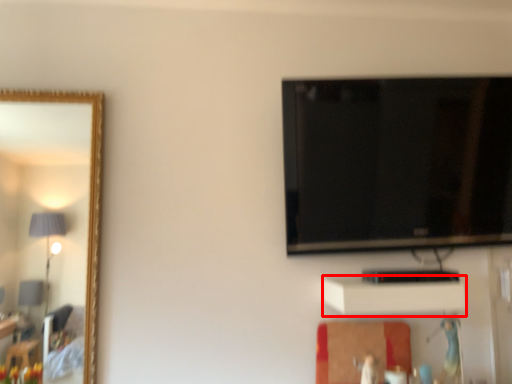
Question: From the image's perspective, considering the relative positions of cabinet (annotated by the red box) and television in the image provided, where is cabinet (annotated by the red box) located with respect to the staircase?

Choices:
 (A) below
 (B) above

Answer: (A)